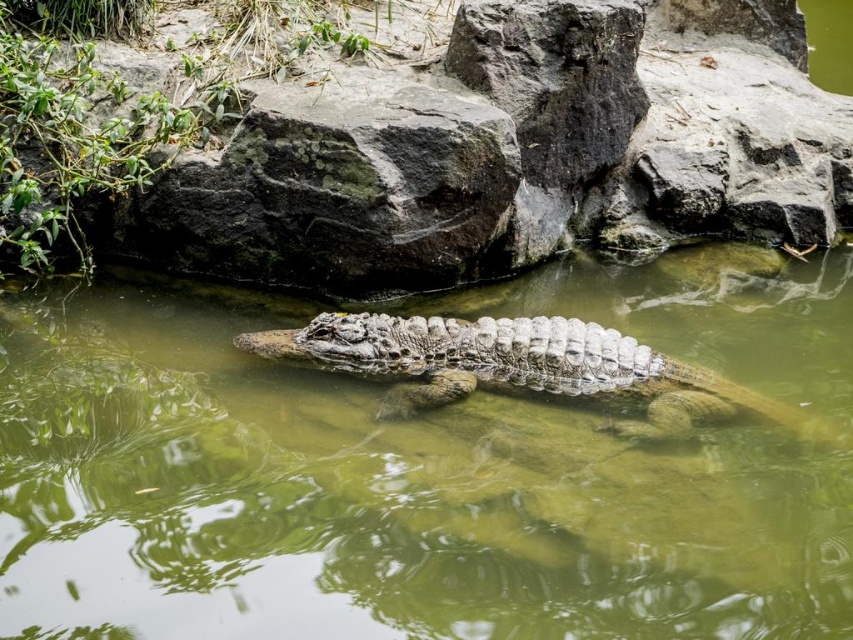
Question: Which point is closer to the camera taking this photo?

Choices:
 (A) (619, 67)
 (B) (398, 392)

Answer: (B)

Question: Is gray rough rock at center positioned before scaly brown crocodile at center?

Choices:
 (A) no
 (B) yes

Answer: (A)

Question: Which object appears farthest from the camera in this image?

Choices:
 (A) greenish murky water at center
 (B) scaly brown crocodile at center
 (C) gray rough rock at center

Answer: (C)

Question: Is gray rough rock at center wider than scaly brown crocodile at center?

Choices:
 (A) no
 (B) yes

Answer: (B)

Question: Which point appears farthest from the camera in this image?

Choices:
 (A) (496, 372)
 (B) (683, 308)
 (C) (171, 208)

Answer: (B)

Question: Does greenish murky water at center have a larger size compared to gray rough rock at center?

Choices:
 (A) yes
 (B) no

Answer: (B)